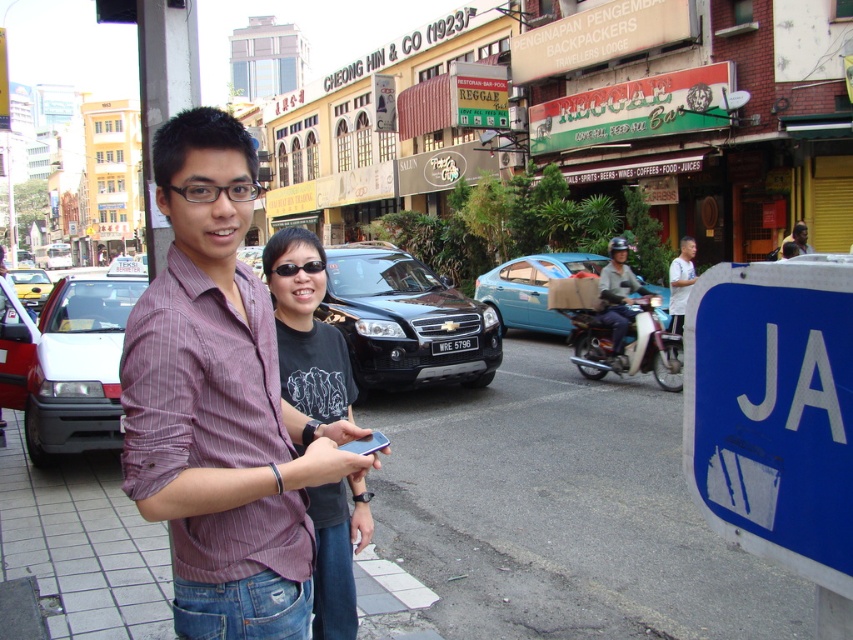
You are a photographer trying to capture a candid shot of the two people in the scene. You notice the black matte shirt at center and the white cotton shirt at center. Which shirt is positioned lower in the frame?

The black matte shirt at center is below the white cotton shirt at center, so it is positioned lower in the frame.

You are a photographer trying to capture both the black matte shirt at center and the white cotton shirt at center in your shot. Since you want to highlight both equally, which shirt should you move closer to the camera to balance their sizes in the photo?

Since the black matte shirt at center occupies less space than the white cotton shirt at center, you should move the black matte shirt at center closer to the camera to make it appear larger in the photo and balance their sizes.